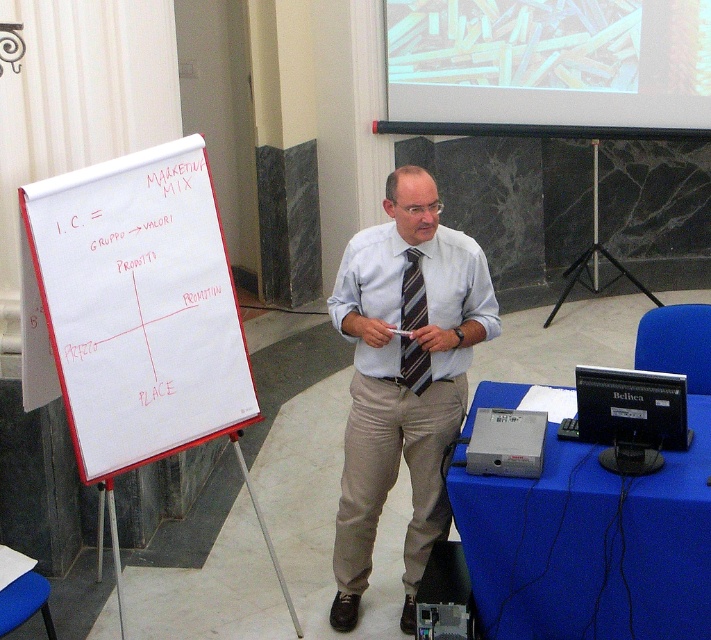
Can you confirm if whiteboard at left is positioned to the right of light blue shirt at center?

In fact, whiteboard at left is to the left of light blue shirt at center.

Between point (82, 388) and point (400, 305), which one is positioned in front?

Positioned in front is point (82, 388).

I want to click on whiteboard at left, so click(139, 307).

Which is in front, point (384, 353) or point (629, 426)?

Positioned in front is point (629, 426).

From the picture: Who is more distant from viewer, (x=464, y=288) or (x=631, y=397)?

The point (x=464, y=288) is behind.

The width and height of the screenshot is (711, 640). I want to click on light blue cotton dress shirt at center, so click(x=456, y=282).

What do you see at coordinates (402, 376) in the screenshot?
I see `light blue shirt at center` at bounding box center [402, 376].

This screenshot has width=711, height=640. Identify the location of light blue shirt at center. (402, 376).